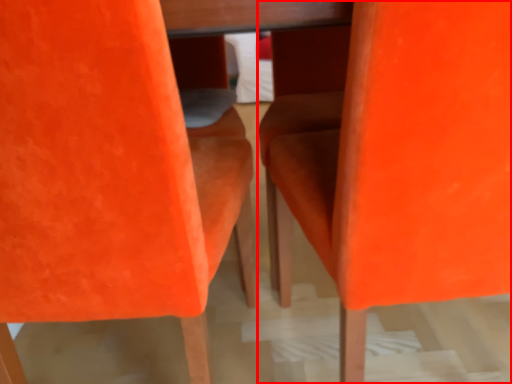
Question: From the image's perspective, considering the relative positions of chair (annotated by the red box) and chair in the image provided, where is chair (annotated by the red box) located with respect to the staircase?

Choices:
 (A) above
 (B) below

Answer: (A)